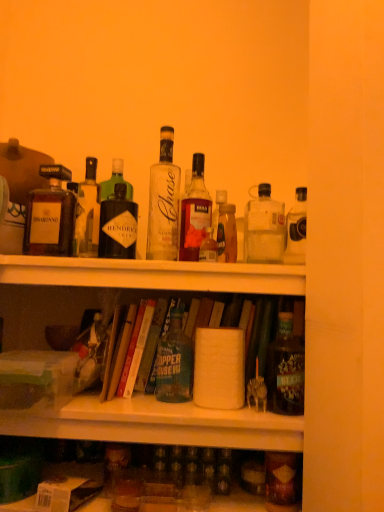
Question: Is matte black bottle at right, placed as the first bottle when sorted from right to left, not inside translucent glass bottle at center, which is the sixth bottle from left to right?

Choices:
 (A) no
 (B) yes

Answer: (B)

Question: Is matte black bottle at right, placed as the first bottle when sorted from right to left, at the right side of translucent glass bottle at center, which is the sixth bottle from left to right?

Choices:
 (A) yes
 (B) no

Answer: (A)

Question: Does matte black bottle at right, which ranks as the 9th bottle in left-to-right order, have a greater width compared to translucent glass bottle at center, which is the sixth bottle from left to right?

Choices:
 (A) yes
 (B) no

Answer: (A)

Question: Does matte black bottle at right, placed as the first bottle when sorted from right to left, have a lesser width compared to translucent glass bottle at center, which is the fourth bottle from right to left?

Choices:
 (A) yes
 (B) no

Answer: (B)

Question: Considering the relative sizes of matte black bottle at right, placed as the first bottle when sorted from right to left, and translucent glass bottle at center, which is the sixth bottle from left to right, in the image provided, is matte black bottle at right, placed as the first bottle when sorted from right to left, bigger than translucent glass bottle at center, which is the sixth bottle from left to right,?

Choices:
 (A) no
 (B) yes

Answer: (B)

Question: Considering the positions of point (288, 499) and point (302, 340), is point (288, 499) closer or farther from the camera than point (302, 340)?

Choices:
 (A) farther
 (B) closer

Answer: (B)

Question: From the image's perspective, relative to matte black bottle at right, placed as the first bottle when sorted from right to left, is matte brown bottle at lower right, the 2th bottle from the right, above or below?

Choices:
 (A) below
 (B) above

Answer: (A)

Question: Relative to matte black bottle at right, placed as the first bottle when sorted from right to left, is matte brown bottle at lower right, the 2th bottle from the right, in front or behind?

Choices:
 (A) behind
 (B) front

Answer: (B)

Question: Visually, is matte brown bottle at lower right, the 2th bottle from the right, positioned to the left or to the right of matte black bottle at right, which ranks as the 9th bottle in left-to-right order?

Choices:
 (A) left
 (B) right

Answer: (A)

Question: Is point (79, 245) closer or farther from the camera than point (82, 269)?

Choices:
 (A) farther
 (B) closer

Answer: (A)

Question: Is clear glass bottle at upper left, arranged as the 8th bottle when viewed from the right, inside the boundaries of white matte shelf at upper center, or outside?

Choices:
 (A) inside
 (B) outside

Answer: (B)

Question: Considering their positions, is clear glass bottle at upper left, arranged as the 8th bottle when viewed from the right, located in front of or behind white matte shelf at upper center?

Choices:
 (A) behind
 (B) front

Answer: (A)

Question: From a real-world perspective, is clear glass bottle at upper left, arranged as the 8th bottle when viewed from the right, physically located above or below white matte shelf at upper center?

Choices:
 (A) above
 (B) below

Answer: (A)

Question: From the image's perspective, is matte brown bottle at left, which ranks as the 1th bottle in left-to-right order, located above or below white matte shelf at upper center?

Choices:
 (A) above
 (B) below

Answer: (A)

Question: From their relative heights in the image, would you say matte brown bottle at left, arranged as the ninth bottle when viewed from the right, is taller or shorter than white matte shelf at upper center?

Choices:
 (A) short
 (B) tall

Answer: (B)